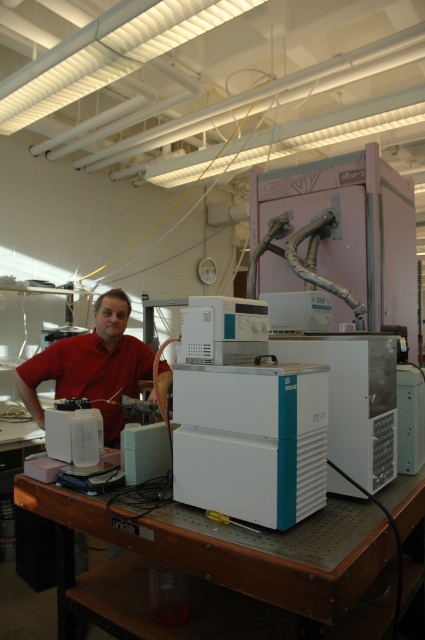
You are a lab technician who needs to place a new sample on the workbench. Given that you are facing the white plastic equipment at center, which direction should you move to reach the white plastic workbench at lower center?

The white plastic workbench at lower center is behind the white plastic equipment at center, so you should move backward to reach it.

Looking at this image, you are a lab technician who needs to place a new tool on the workbench. Can you place it directly on the white plastic workbench at lower center without moving the matte red shirt at center?

The matte red shirt at center is located above the white plastic workbench at lower center, so you cannot place the tool directly on the workbench without moving the shirt first.

You are a lab technician who needs to place a new sensor on the table. The sensor is too heavy to lift over the equipment. Can you place it directly on the white plastic workbench at lower center without moving the white plastic equipment at center?

The white plastic equipment at center is above the white plastic workbench at lower center, so you can place the sensor directly on the white plastic workbench at lower center without moving the equipment since there is space beneath it.